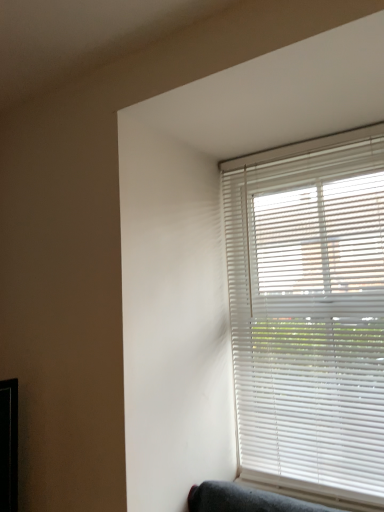
What do you see at coordinates (309, 313) in the screenshot? Image resolution: width=384 pixels, height=512 pixels. I see `white matte blinds at upper right` at bounding box center [309, 313].

Identify the location of white matte blinds at upper right. The width and height of the screenshot is (384, 512). (309, 313).

At what (x,y) coordinates should I click in order to perform the action: click on white matte blinds at upper right. Please return your answer as a coordinate pair (x, y). Looking at the image, I should click on (309, 313).